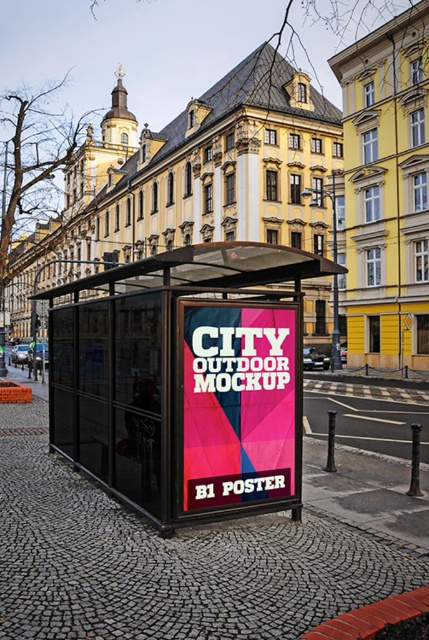
Between metallic glass bus stop at center and matte pink poster at center, which one appears on the left side from the viewer's perspective?

Positioned to the left is matte pink poster at center.

The width and height of the screenshot is (429, 640). Identify the location of metallic glass bus stop at center. (186, 380).

At what (x,y) coordinates should I click in order to perform the action: click on metallic glass bus stop at center. Please return your answer as a coordinate pair (x, y). The image size is (429, 640). Looking at the image, I should click on (186, 380).